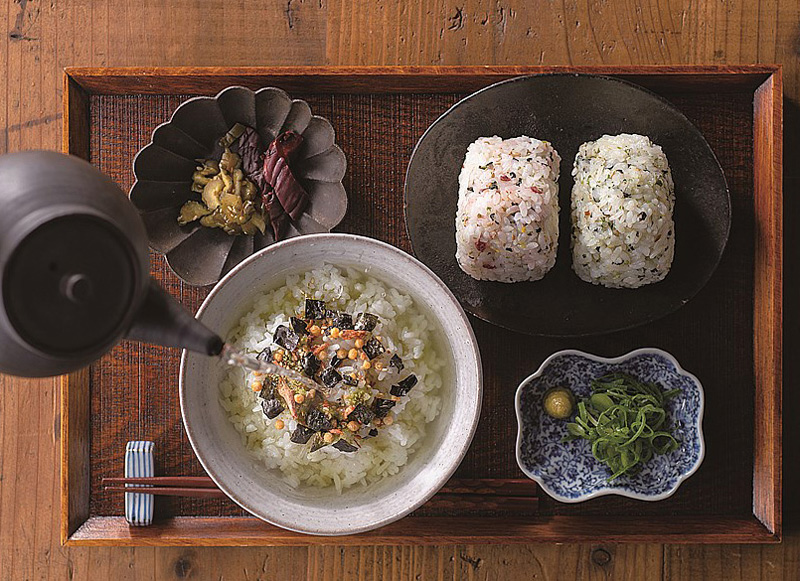
At what (x,y) coordinates should I click in order to perform the action: click on table. Please return your answer as a coordinate pair (x, y). Looking at the image, I should click on (40, 554), (46, 50), (693, 25).